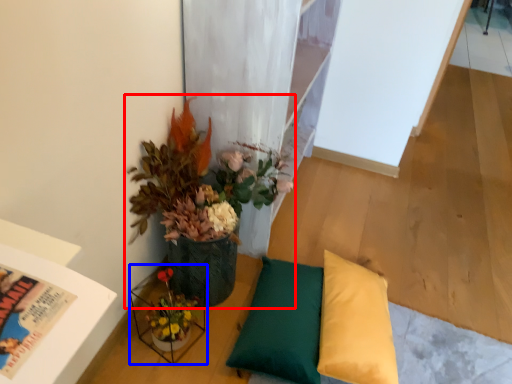
Question: Which point is further to the camera, houseplant (highlighted by a red box) or vase (highlighted by a blue box)?

Choices:
 (A) houseplant
 (B) vase

Answer: (B)